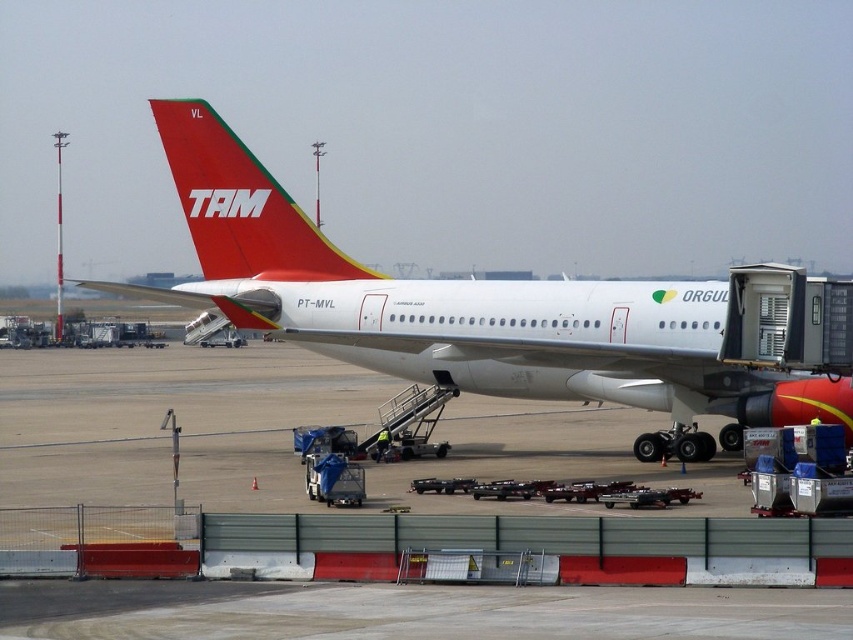
Question: Is white glossy airplane at center below matte red airplane tail at upper center?

Choices:
 (A) no
 (B) yes

Answer: (B)

Question: Is white glossy airplane at center to the right of matte red airplane tail at upper center from the viewer's perspective?

Choices:
 (A) no
 (B) yes

Answer: (A)

Question: Does white glossy airplane at center appear on the left side of matte red airplane tail at upper center?

Choices:
 (A) no
 (B) yes

Answer: (B)

Question: Which point is farther to the camera?

Choices:
 (A) (171, 116)
 (B) (486, 314)

Answer: (A)

Question: Which point appears closest to the camera in this image?

Choices:
 (A) (552, 364)
 (B) (248, 259)

Answer: (A)